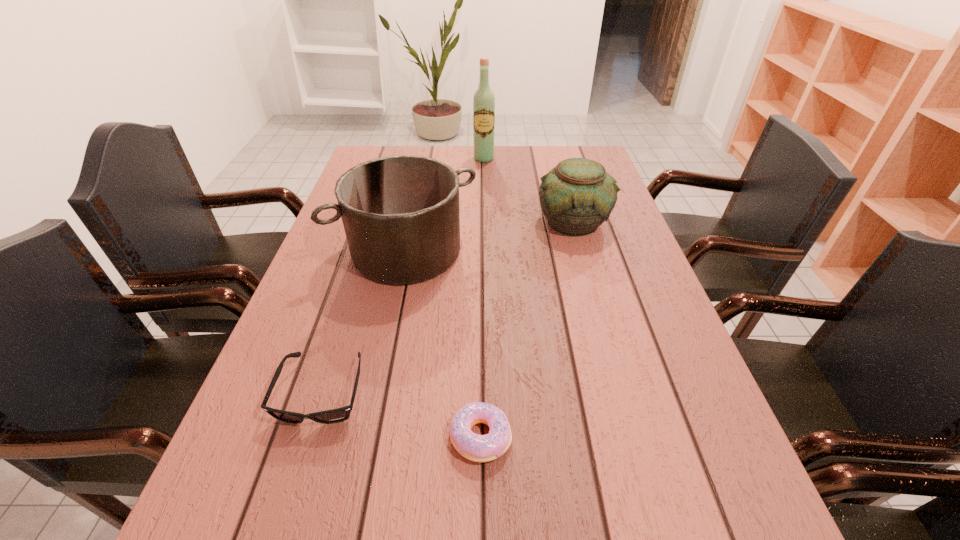
The height and width of the screenshot is (540, 960). In order to click on free location located on the front-facing side of the second shortest object in this screenshot , I will do click(x=292, y=488).

Locate an element on the screen. This screenshot has width=960, height=540. free space located 0.210m on the back of the shortest object is located at coordinates (481, 325).

You are a GUI agent. You are given a task and a screenshot of the screen. Output one action in this format:
    pyautogui.click(x=<x>, y=<y>)
    Task: Click on the object that is at the far edge
    
    Given the screenshot: What is the action you would take?
    pyautogui.click(x=484, y=100)

Identify the location of pan present at the left edge. (400, 213).

Identify the location of sunglasses that is at the left edge. (341, 414).

This screenshot has width=960, height=540. Identify the location of object positioned at the right edge. (577, 196).

Where is `vacant space at the left edge`? The width and height of the screenshot is (960, 540). vacant space at the left edge is located at coordinates [x=347, y=354].

At what (x,y) coordinates should I click in order to perform the action: click on vacant area at the right edge of the desktop. Please return your answer as a coordinate pair (x, y). The image size is (960, 540). Looking at the image, I should click on (623, 261).

In order to click on free spot between the shortest object and the sunglasses in this screenshot , I will do `click(401, 415)`.

This screenshot has width=960, height=540. In order to click on free space between the rightmost object and the wine bottle in this screenshot , I will do `click(529, 190)`.